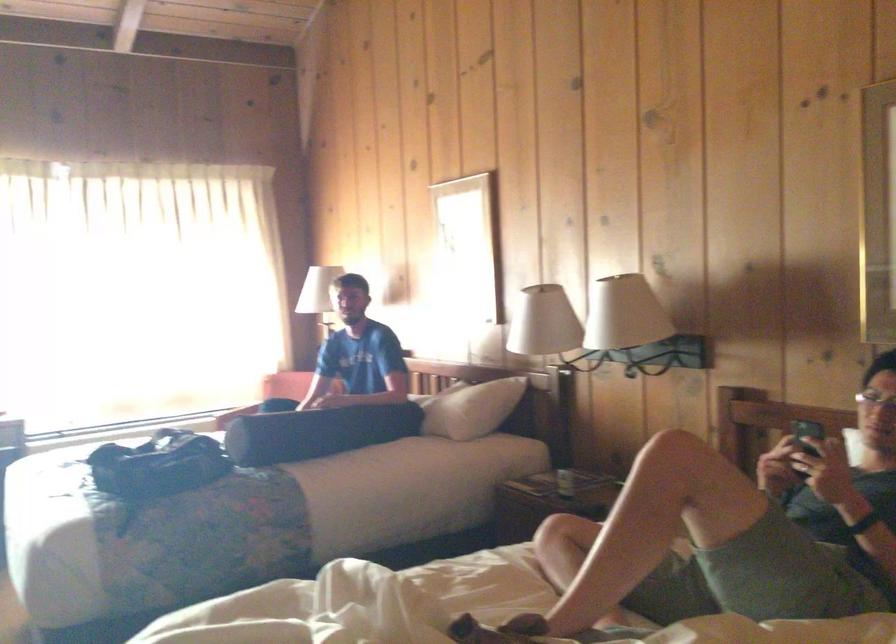
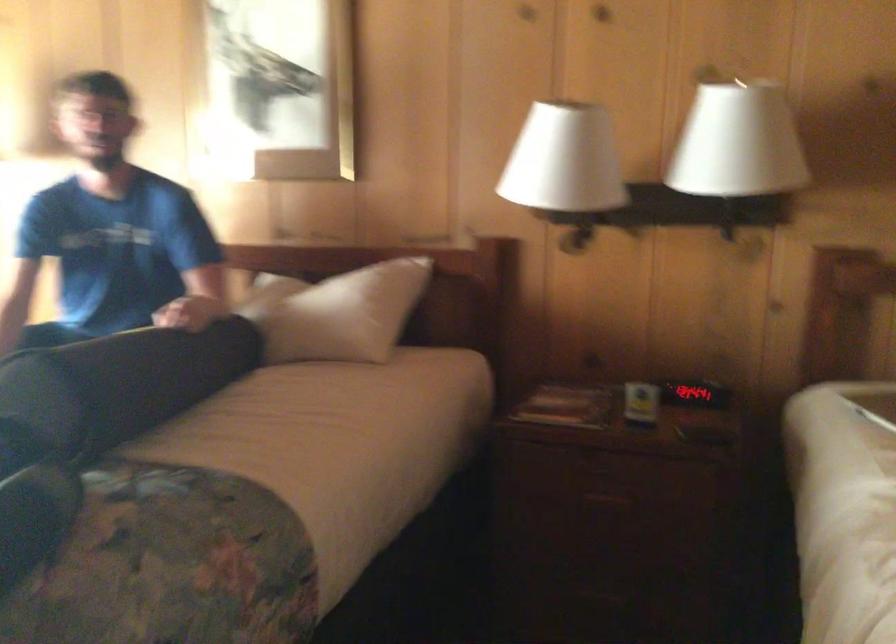
Locate, in the second image, the point that corresponds to (x=593, y=317) in the first image.

(737, 143)